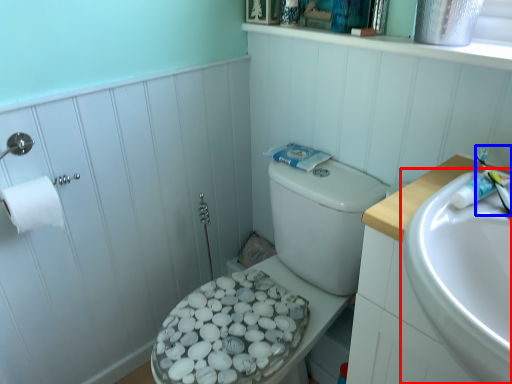
Question: Which point is closer to the camera, sink (highlighted by a red box) or toothbrush (highlighted by a blue box)?

Choices:
 (A) sink
 (B) toothbrush

Answer: (A)